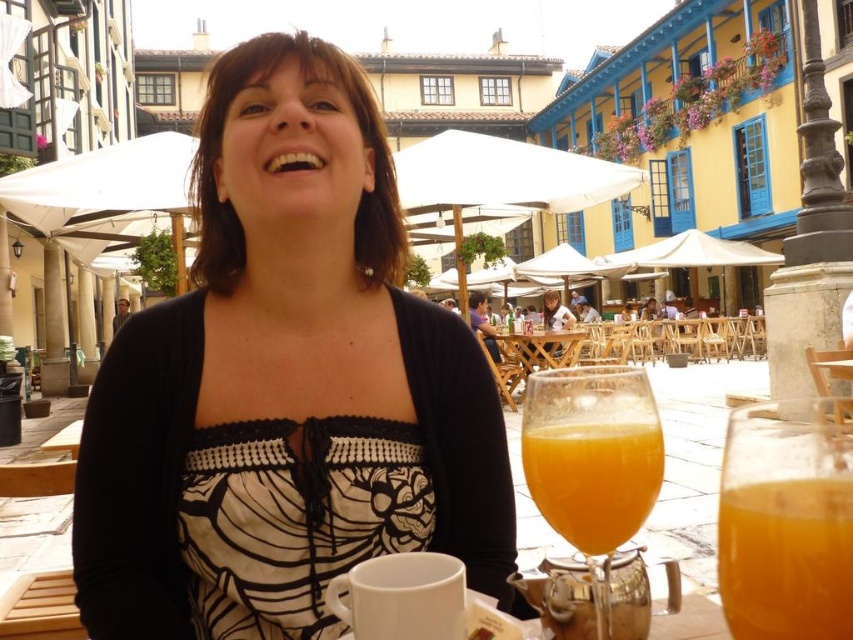
Question: Is matte black top at center positioned at the back of translucent glass at lower center?

Choices:
 (A) yes
 (B) no

Answer: (A)

Question: Which point appears farthest from the camera in this image?

Choices:
 (A) (561, 465)
 (B) (567, 308)
 (C) (505, 392)
 (D) (762, 614)

Answer: (B)

Question: Which point is farther to the camera?

Choices:
 (A) orange liquid at center
 (B) translucent glass at lower center
 (C) wooden table at center
 (D) matte black top at center

Answer: (C)

Question: Is translucent glass at lower center closer to the viewer compared to matte black dress at center?

Choices:
 (A) no
 (B) yes

Answer: (B)

Question: Does orange liquid at center appear on the right side of matte black dress at center?

Choices:
 (A) no
 (B) yes

Answer: (A)

Question: Considering the real-world distances, which object is farthest from the wooden table at center?

Choices:
 (A) translucent glass at lower center
 (B) matte black dress at center

Answer: (A)